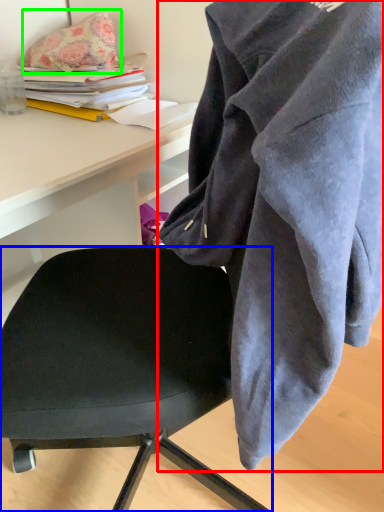
Question: Estimate the real-world distances between objects in this image. Which object is farther from cloak (highlighted by a red box), chair (highlighted by a blue box) or pillow (highlighted by a green box)?

Choices:
 (A) chair
 (B) pillow

Answer: (B)